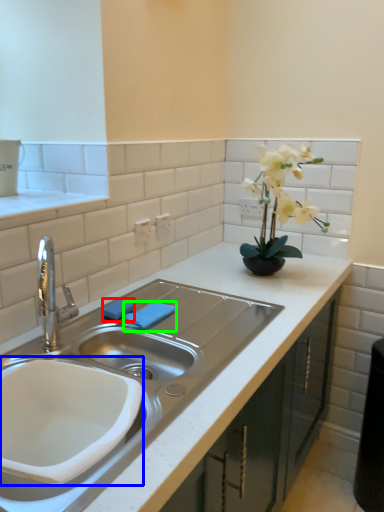
Question: Estimate the real-world distances between objects in this image. Which object is farther from soap (highlighted by a red box), sink (highlighted by a blue box) or towel bar (highlighted by a green box)?

Choices:
 (A) sink
 (B) towel bar

Answer: (A)